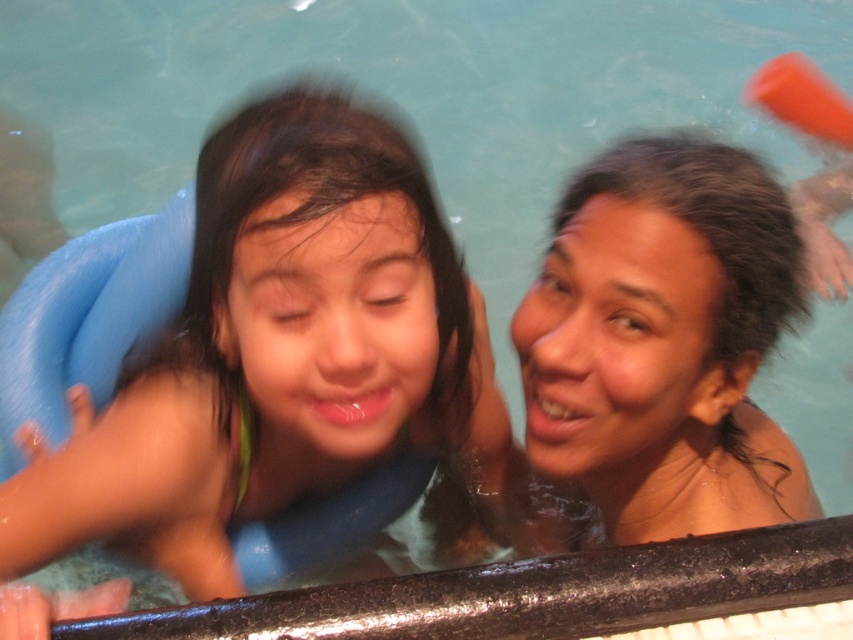
Question: Can you confirm if smooth blue float at left is positioned to the right of smooth skin woman at upper right?

Choices:
 (A) no
 (B) yes

Answer: (A)

Question: Is smooth blue float at left positioned at the back of smooth skin woman at upper right?

Choices:
 (A) no
 (B) yes

Answer: (A)

Question: Which of the following is the farthest from the observer?

Choices:
 (A) [x=339, y=260]
 (B) [x=759, y=259]

Answer: (B)

Question: Can you confirm if smooth blue float at left is smaller than smooth skin woman at upper right?

Choices:
 (A) no
 (B) yes

Answer: (A)